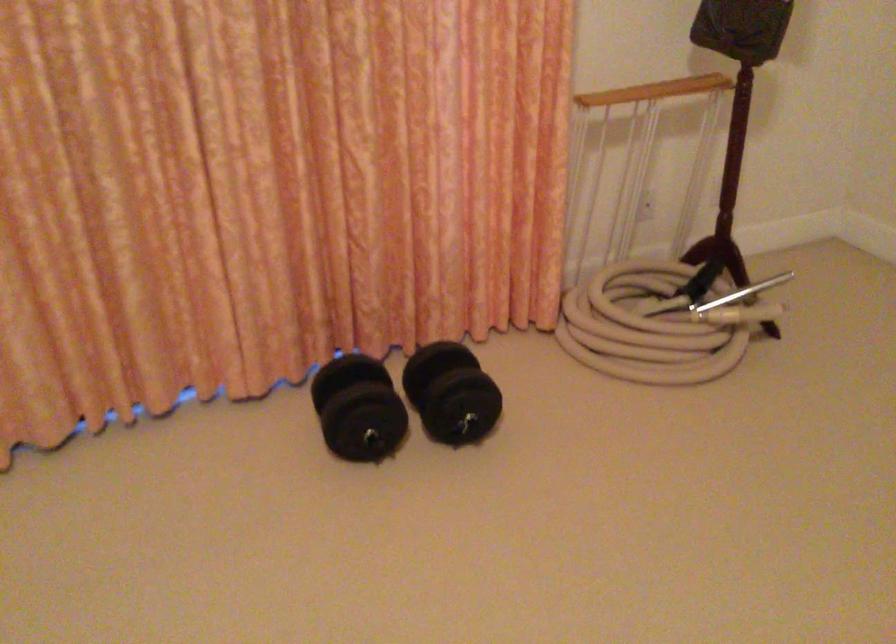
What are the coordinates of `vacuum wand handle` in the screenshot? It's located at (719, 137).